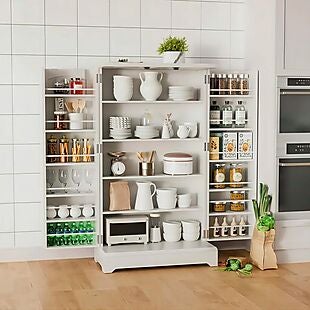
This screenshot has height=310, width=310. What are the coordinates of `wine glasses` in the screenshot? It's located at (90, 173), (80, 175), (65, 174), (51, 173).